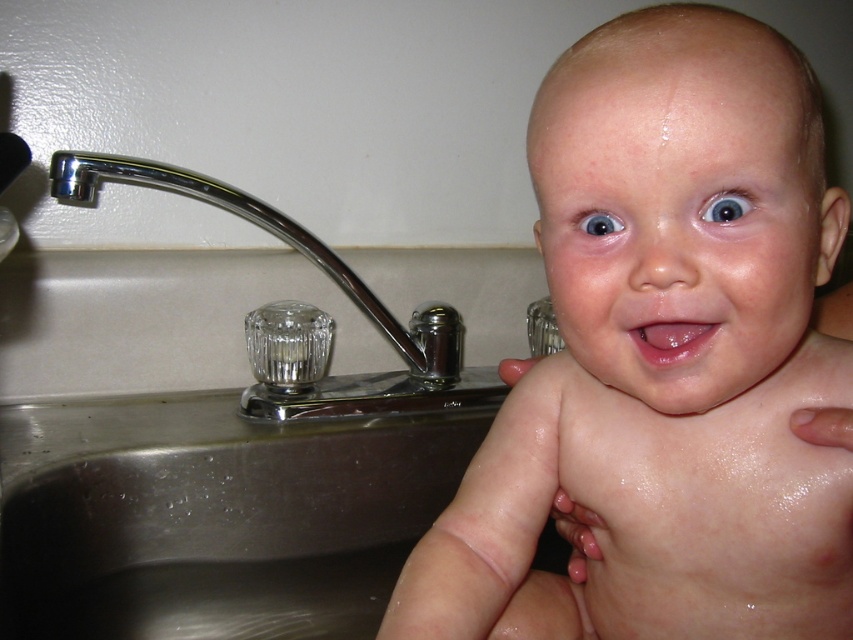
You are holding a baby over a sink and want to place a small toy near the point marked at coordinates point (833, 550). If the toy is 3 inches in diameter, will it fit entirely within the sink?

The point marked at coordinates point (833, 550) is 16.02 inches away from the camera. Since the toy is only 3 inches in diameter, it will fit entirely within the sink as long as the sink is large enough to accommodate the toy at that distance.

You are a parent holding your baby near the silver metallic sink at left. To avoid slipping, you want to place your foot on a non slippery surface. Where should you step?

You should step away from the silver metallic sink at left because it has water droplets on its surface which can be slippery.